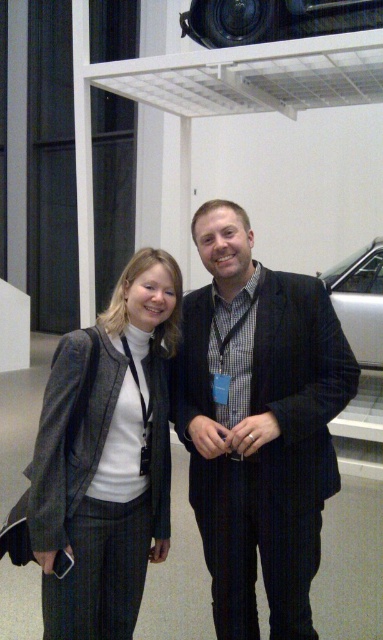
Question: Which point is farther to the camera?

Choices:
 (A) matte gray blazer at center
 (B) dark pinstripe suit at center
 (C) silver metallic car at right

Answer: (C)

Question: Which point is farther to the camera?

Choices:
 (A) (222, 12)
 (B) (371, 278)
 (C) (302, 337)
 (D) (93, 520)

Answer: (B)

Question: Is dark pinstripe suit at center further to camera compared to silver metallic car at right?

Choices:
 (A) yes
 (B) no

Answer: (B)

Question: Does dark pinstripe suit at center lie in front of silver metallic car at right?

Choices:
 (A) no
 (B) yes

Answer: (B)

Question: Among these points, which one is nearest to the camera?

Choices:
 (A) (356, 17)
 (B) (381, 307)
 (C) (130, 349)
 (D) (294, 620)

Answer: (C)

Question: Does dark pinstripe suit at center appear under silver metallic car at right?

Choices:
 (A) no
 (B) yes

Answer: (B)